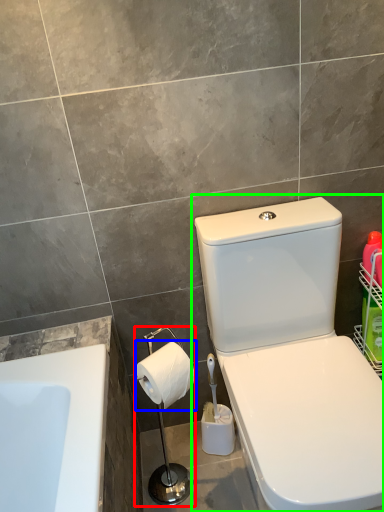
Question: Which object is positioned farthest from shower (highlighted by a red box)? Select from toilet paper (highlighted by a blue box) and toilet (highlighted by a green box).

Choices:
 (A) toilet paper
 (B) toilet

Answer: (B)